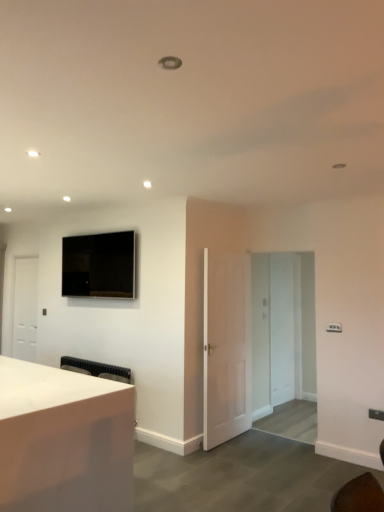
Question: Considering the relative sizes of white matte door at left, the 2th door from the front, and white glossy desk at lower left in the image provided, is white matte door at left, the 2th door from the front, smaller than white glossy desk at lower left?

Choices:
 (A) no
 (B) yes

Answer: (B)

Question: Could you tell me if white matte door at left, which appears as the 2th door when viewed from the right, is turned towards white glossy desk at lower left?

Choices:
 (A) no
 (B) yes

Answer: (A)

Question: Is white glossy desk at lower left completely or partially inside white matte door at left, the 1th door positioned from the left?

Choices:
 (A) yes
 (B) no

Answer: (B)

Question: Is white glossy desk at lower left at the back of white matte door at left, the 1th door positioned from the left?

Choices:
 (A) yes
 (B) no

Answer: (B)

Question: From a real-world perspective, is white matte door at left, the 2th door from the front, under white glossy desk at lower left?

Choices:
 (A) yes
 (B) no

Answer: (B)

Question: Does white matte door at left, the 1th door positioned from the left, appear on the left side of white glossy desk at lower left?

Choices:
 (A) no
 (B) yes

Answer: (B)

Question: From the image's perspective, is matte black tv at upper left located above white matte door at left, which appears as the 2th door when viewed from the right?

Choices:
 (A) yes
 (B) no

Answer: (A)

Question: Is matte black tv at upper left at the left side of white matte door at left, the 2th door from the front?

Choices:
 (A) yes
 (B) no

Answer: (B)

Question: Is matte black tv at upper left positioned behind white matte door at left, the first door when ordered from back to front?

Choices:
 (A) no
 (B) yes

Answer: (A)

Question: From the image's perspective, is matte black tv at upper left beneath white matte door at left, which appears as the 2th door when viewed from the right?

Choices:
 (A) no
 (B) yes

Answer: (A)

Question: Is the depth of matte black tv at upper left less than that of white matte door at left, which appears as the 2th door when viewed from the right?

Choices:
 (A) yes
 (B) no

Answer: (A)

Question: Is matte black tv at upper left aimed at white matte door at left, which appears as the 2th door when viewed from the right?

Choices:
 (A) no
 (B) yes

Answer: (A)

Question: Does transparent glass door at center come in front of white glossy desk at lower left?

Choices:
 (A) yes
 (B) no

Answer: (B)